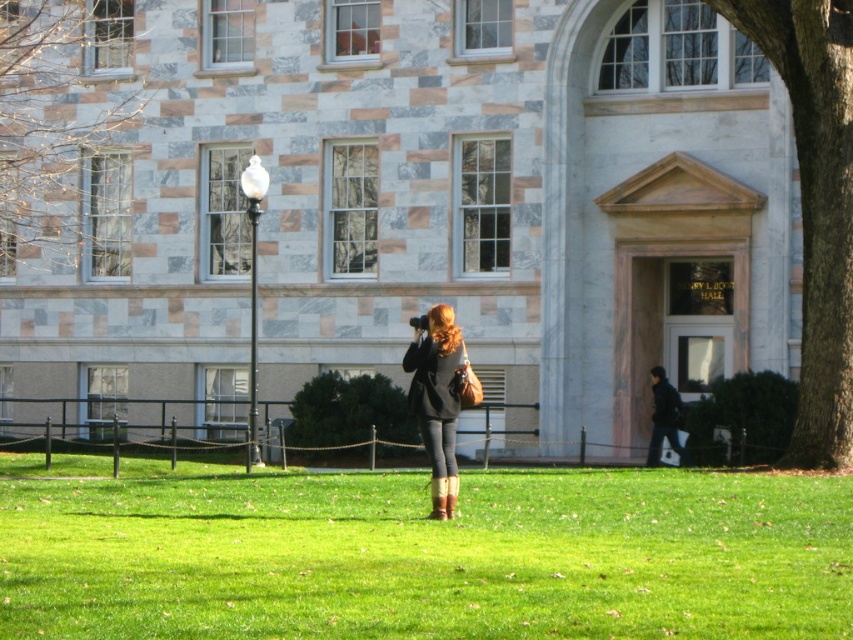
You are standing at the point marked as point [427,556] in the image. What do you see directly under your feet?

You see green grass at center directly under your feet at point [427,556].

You are standing in front of Henry L. Davis Hall and see the green grass at center and the matte black jacket at center. Which object is closer to you?

The matte black jacket at center is closer to you because it is positioned above the green grass at center, which is underneath it.

You are standing at the point marked by the coordinates point (427, 556) in the image. What surface are you currently standing on?

You are standing on the green grass at center because the point (427, 556) is located there.